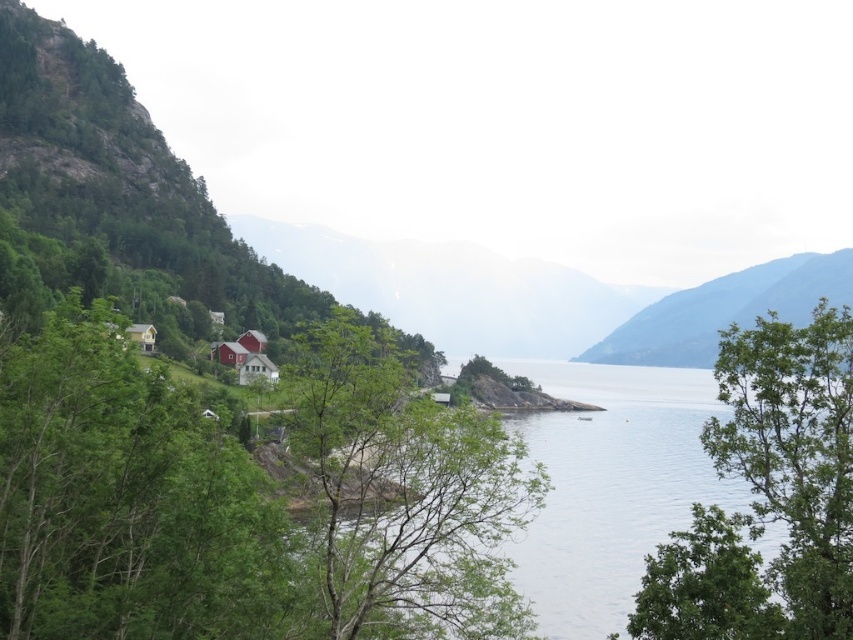
Question: Does green leafy tree at center have a larger size compared to green leafy tree at right?

Choices:
 (A) no
 (B) yes

Answer: (A)

Question: Does green leafy tree at left have a larger size compared to green leafy tree at center?

Choices:
 (A) no
 (B) yes

Answer: (B)

Question: Does green leafy tree at left lie in front of gray rocky mountain at upper center?

Choices:
 (A) yes
 (B) no

Answer: (A)

Question: Which object appears closest to the camera in this image?

Choices:
 (A) clear water at lower left
 (B) matte red wooden house at lower left
 (C) green leafy tree at right

Answer: (C)

Question: Considering the real-world distances, which object is farthest from the green leafy tree at left?

Choices:
 (A) gray rocky mountain at upper center
 (B) matte red wooden house at lower left

Answer: (A)

Question: Which object appears closest to the camera in this image?

Choices:
 (A) green leafy tree at center
 (B) green leafy tree at left
 (C) gray rocky mountain at upper center

Answer: (A)